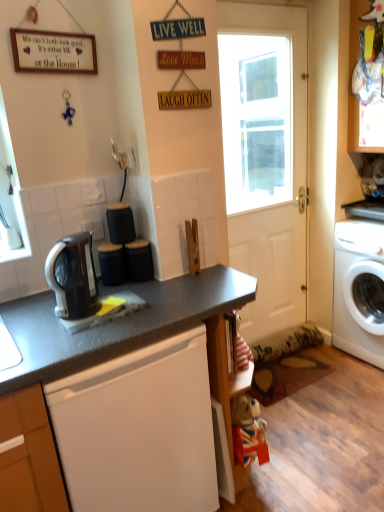
This screenshot has height=512, width=384. Find the location of `vacant area situated below black glossy coffee maker at left (from a real-world perspective)`. vacant area situated below black glossy coffee maker at left (from a real-world perspective) is located at coordinates (91, 313).